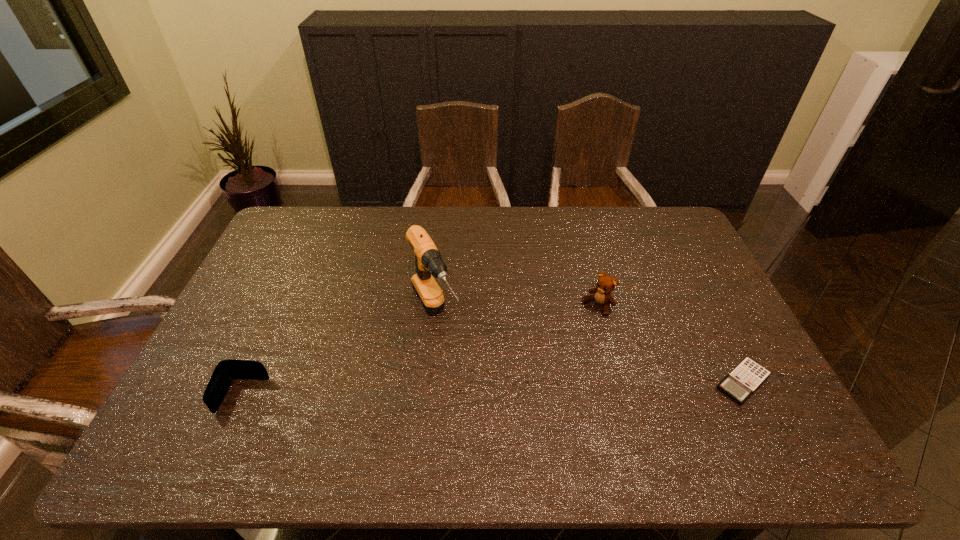
The image size is (960, 540). In order to click on object positioned at the near right corner in this screenshot , I will do `click(747, 376)`.

The width and height of the screenshot is (960, 540). In the image, there is a desktop. What are the coordinates of `free region at the far edge` in the screenshot? It's located at (399, 218).

At what (x,y) coordinates should I click in order to perform the action: click on free space at the near edge of the desktop. Please return your answer as a coordinate pair (x, y). The width and height of the screenshot is (960, 540). Looking at the image, I should click on (396, 413).

Identify the location of free space at the left edge of the desktop. The height and width of the screenshot is (540, 960). (247, 305).

Identify the location of vacant space at the right edge. Image resolution: width=960 pixels, height=540 pixels. (669, 278).

What are the coordinates of `vacant space at the far left corner of the desktop` in the screenshot? It's located at (315, 208).

Find the location of a particular element. empty space between the second shortest object and the drill is located at coordinates (339, 356).

Image resolution: width=960 pixels, height=540 pixels. What are the coordinates of `free space that is in between the shortest object and the third object from left to right` in the screenshot? It's located at (670, 344).

This screenshot has width=960, height=540. I want to click on empty location between the drill and the third shortest object, so click(516, 310).

Locate an element on the screen. The width and height of the screenshot is (960, 540). free space between the third object from right to left and the wallet is located at coordinates (339, 356).